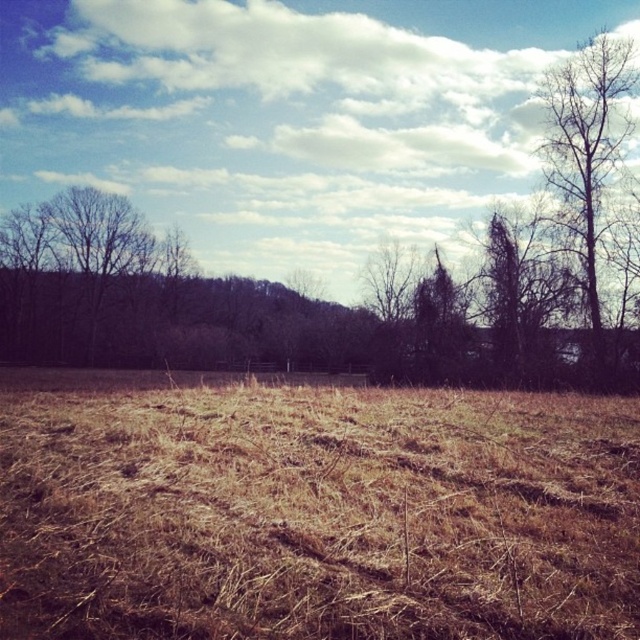
You are standing in the middle of the field and notice a specific point marked at coordinates (x=312, y=509). What object is located at that point?

The brown dry grass at center is located at point (x=312, y=509).

You are a farmer checking the field conditions. You notice the brown dry grass at center and the bare branches at right. Which area would you prioritize for irrigation based on their spatial relationship?

The brown dry grass at center might be wider than the bare branches at right, so the grass area requires more immediate attention as it covers a larger area and is more vulnerable to drying out further.

You are standing in the field and want to walk towards the dense cluster of trees in the background. Which object, the brown dry grass at center or the bare branches at right, would you encounter first as you move forward?

You would first encounter the brown dry grass at center because it is closer to the viewer than the bare branches at right, which are further away in the scene.